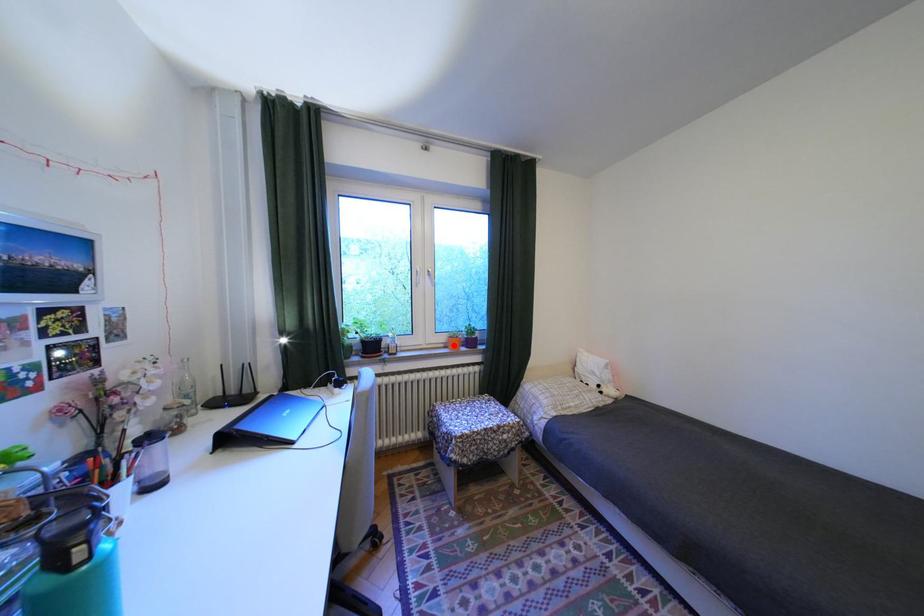
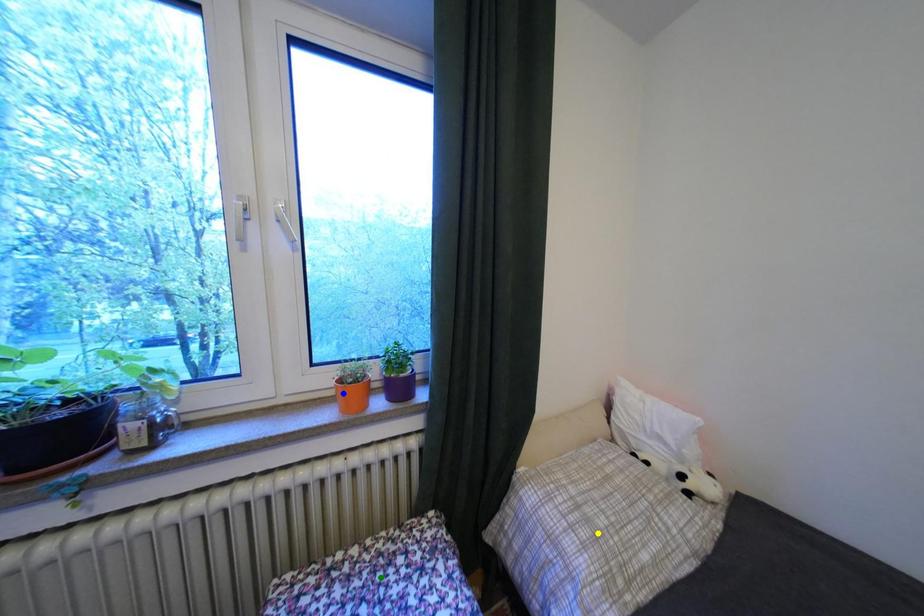
Question: I am providing you with two images of the same scene from different viewpoints. A red point is marked on the first image. You are given multiple points on the second image. In image 2, which mark is for the same physical point as the one in image 1?

Choices:
 (A) green point
 (B) blue point
 (C) yellow point

Answer: (B)